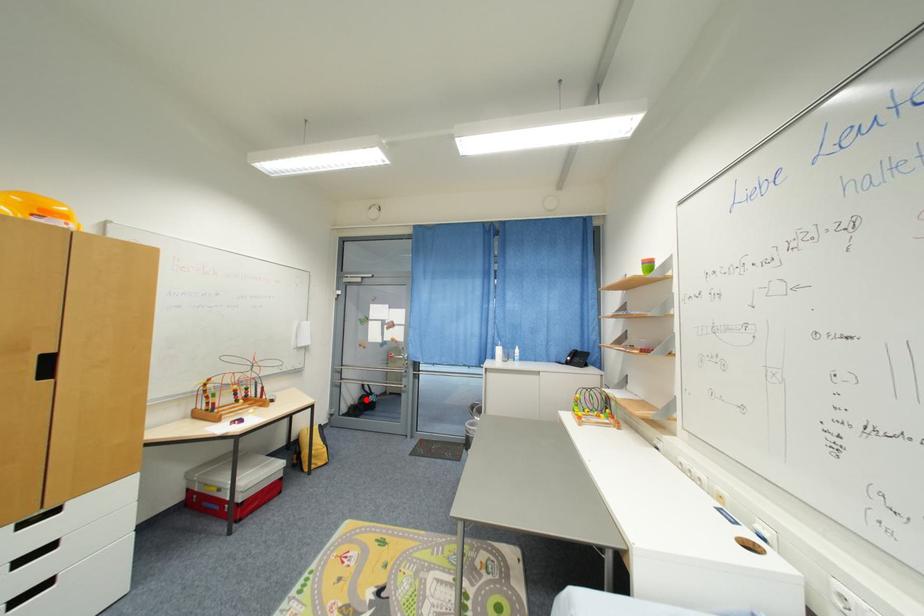
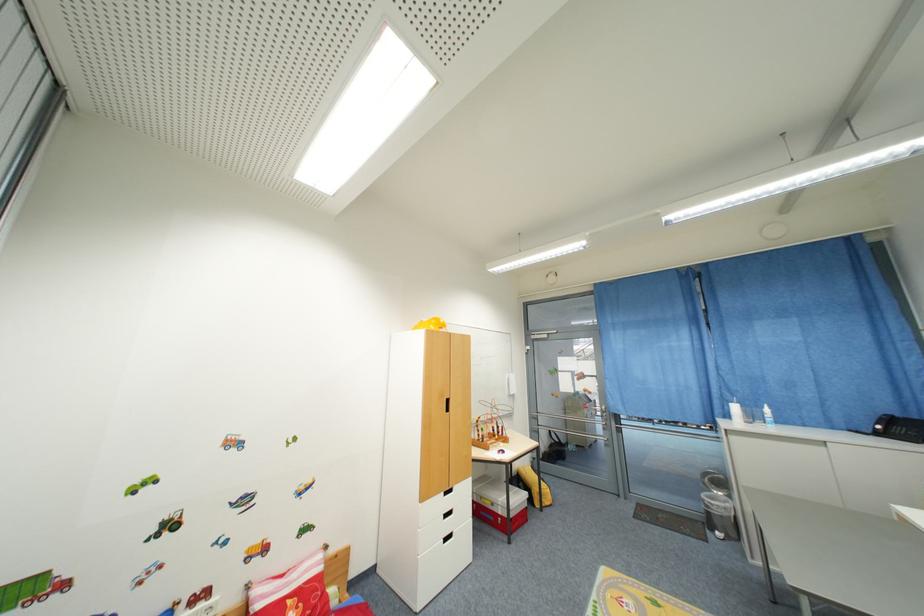
Where in the second image is the point corresponding to the highlighted location from the first image?

(555, 448)